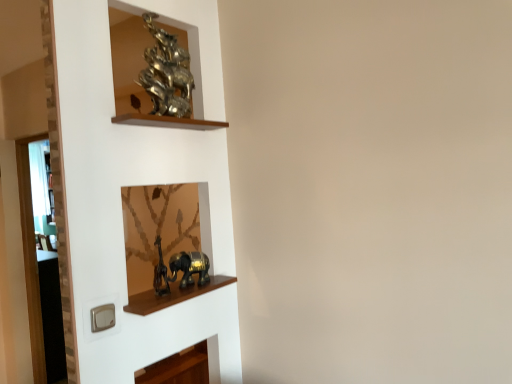
Identify the location of metallic gold elephant at center, placed as the second cabinet when sorted from top to bottom. This screenshot has width=512, height=384. (173, 296).

In order to click on wooden shelf at upper center, marked as the first cabinet in a top-to-bottom arrangement in this screenshot , I will do `click(167, 121)`.

Where is `metallic gold elephant at center, which is the 1th cabinet from bottom to top`? metallic gold elephant at center, which is the 1th cabinet from bottom to top is located at coordinates click(173, 296).

Based on the photo, relative to metallic gold elephant at center, placed as the second cabinet when sorted from top to bottom, is gold metallic elephant at lower center, acting as the 2th art starting from the top, in front or behind?

gold metallic elephant at lower center, acting as the 2th art starting from the top, is positioned farther from the viewer than metallic gold elephant at center, placed as the second cabinet when sorted from top to bottom.

Can you confirm if gold metallic elephant at lower center, the 1th art when ordered from bottom to top, is bigger than metallic gold elephant at center, which is the 1th cabinet from bottom to top?

Correct, gold metallic elephant at lower center, the 1th art when ordered from bottom to top, is larger in size than metallic gold elephant at center, which is the 1th cabinet from bottom to top.

Which is more distant, (189,281) or (200,286)?

The point (200,286) is farther.

Is gold metallic elephant at lower center, acting as the 2th art starting from the top, placed right next to metallic gold elephant at center, which is the 1th cabinet from bottom to top?

Yes.

The height and width of the screenshot is (384, 512). What are the coordinates of `cabinet to the left of metallic gold elephant at center, placed as the second cabinet when sorted from top to bottom` in the screenshot? It's located at (167, 121).

From the picture: From a real-world perspective, is metallic gold elephant at center, which is the 1th cabinet from bottom to top, over wooden shelf at upper center, the 2th cabinet ordered from the bottom?

No, from a real-world perspective, metallic gold elephant at center, which is the 1th cabinet from bottom to top, is not over wooden shelf at upper center, the 2th cabinet ordered from the bottom

Based on their positions, is metallic gold elephant at center, which is the 1th cabinet from bottom to top, located to the left or right of wooden shelf at upper center, the 2th cabinet ordered from the bottom?

metallic gold elephant at center, which is the 1th cabinet from bottom to top, is to the right of wooden shelf at upper center, the 2th cabinet ordered from the bottom.

Is metallic gold elephant at center, placed as the second cabinet when sorted from top to bottom, positioned with its back to wooden shelf at upper center, the 2th cabinet ordered from the bottom?

metallic gold elephant at center, placed as the second cabinet when sorted from top to bottom, is not turned away from wooden shelf at upper center, the 2th cabinet ordered from the bottom.

From a real-world perspective, is shiny metallic sculpture at upper left, positioned as the 1th art in top-to-bottom order, physically below gold metallic elephant at lower center, acting as the 2th art starting from the top?

No.

Is shiny metallic sculpture at upper left, which is the 2th art in bottom-to-top order, inside or outside of gold metallic elephant at lower center, the 1th art when ordered from bottom to top?

shiny metallic sculpture at upper left, which is the 2th art in bottom-to-top order, is spatially situated outside gold metallic elephant at lower center, the 1th art when ordered from bottom to top.

From the image's perspective, relative to gold metallic elephant at lower center, the 1th art when ordered from bottom to top, is shiny metallic sculpture at upper left, which is the 2th art in bottom-to-top order, above or below?

From the image's perspective, shiny metallic sculpture at upper left, which is the 2th art in bottom-to-top order, appears above gold metallic elephant at lower center, the 1th art when ordered from bottom to top.

Can you tell me how much shiny metallic sculpture at upper left, positioned as the 1th art in top-to-bottom order, and gold metallic elephant at lower center, the 1th art when ordered from bottom to top, differ in facing direction?

8.55e-05 degrees.

From the picture: Is wooden shelf at upper center, the 2th cabinet ordered from the bottom, wider or thinner than gold metallic elephant at lower center, acting as the 2th art starting from the top?

In the image, wooden shelf at upper center, the 2th cabinet ordered from the bottom, appears to be wider than gold metallic elephant at lower center, acting as the 2th art starting from the top.

From a real-world perspective, which is physically above, wooden shelf at upper center, marked as the first cabinet in a top-to-bottom arrangement, or gold metallic elephant at lower center, the 1th art when ordered from bottom to top?

In real-world perspective, wooden shelf at upper center, marked as the first cabinet in a top-to-bottom arrangement, is above.

Is wooden shelf at upper center, marked as the first cabinet in a top-to-bottom arrangement, taller than gold metallic elephant at lower center, the 1th art when ordered from bottom to top?

In fact, wooden shelf at upper center, marked as the first cabinet in a top-to-bottom arrangement, may be shorter than gold metallic elephant at lower center, the 1th art when ordered from bottom to top.

Considering the relative sizes of metallic gold elephant at center, which is the 1th cabinet from bottom to top, and gold metallic elephant at lower center, acting as the 2th art starting from the top, in the image provided, is metallic gold elephant at center, which is the 1th cabinet from bottom to top, taller than gold metallic elephant at lower center, acting as the 2th art starting from the top,?

Incorrect, the height of metallic gold elephant at center, which is the 1th cabinet from bottom to top, is not larger of that of gold metallic elephant at lower center, acting as the 2th art starting from the top.

Looking at the image, does metallic gold elephant at center, placed as the second cabinet when sorted from top to bottom, seem bigger or smaller compared to gold metallic elephant at lower center, the 1th art when ordered from bottom to top?

metallic gold elephant at center, placed as the second cabinet when sorted from top to bottom, is smaller than gold metallic elephant at lower center, the 1th art when ordered from bottom to top.

In the scene shown: From the image's perspective, is metallic gold elephant at center, placed as the second cabinet when sorted from top to bottom, located above gold metallic elephant at lower center, the 1th art when ordered from bottom to top?

No, from the image's perspective, metallic gold elephant at center, placed as the second cabinet when sorted from top to bottom, is not over gold metallic elephant at lower center, the 1th art when ordered from bottom to top.

Which object is positioned more to the right, gold metallic elephant at lower center, the 1th art when ordered from bottom to top, or shiny metallic sculpture at upper left, which is the 2th art in bottom-to-top order?

gold metallic elephant at lower center, the 1th art when ordered from bottom to top, is more to the right.

In the scene shown: Considering the sizes of objects gold metallic elephant at lower center, acting as the 2th art starting from the top, and shiny metallic sculpture at upper left, positioned as the 1th art in top-to-bottom order, in the image provided, who is wider, gold metallic elephant at lower center, acting as the 2th art starting from the top, or shiny metallic sculpture at upper left, positioned as the 1th art in top-to-bottom order,?

shiny metallic sculpture at upper left, positioned as the 1th art in top-to-bottom order, is wider.

The width and height of the screenshot is (512, 384). Find the location of `art in front of the gold metallic elephant at lower center, the 1th art when ordered from bottom to top`. art in front of the gold metallic elephant at lower center, the 1th art when ordered from bottom to top is located at coordinates (166, 73).

Considering the relative sizes of gold metallic elephant at lower center, the 1th art when ordered from bottom to top, and shiny metallic sculpture at upper left, which is the 2th art in bottom-to-top order, in the image provided, is gold metallic elephant at lower center, the 1th art when ordered from bottom to top, taller than shiny metallic sculpture at upper left, which is the 2th art in bottom-to-top order,?

No.

Consider the image. Which of these two, wooden shelf at upper center, the 2th cabinet ordered from the bottom, or shiny metallic sculpture at upper left, which is the 2th art in bottom-to-top order, is thinner?

wooden shelf at upper center, the 2th cabinet ordered from the bottom.

Does point (139, 115) appear closer or farther from the camera than point (170, 75)?

Point (139, 115).

Are wooden shelf at upper center, marked as the first cabinet in a top-to-bottom arrangement, and shiny metallic sculpture at upper left, positioned as the 1th art in top-to-bottom order, far apart?

Actually, wooden shelf at upper center, marked as the first cabinet in a top-to-bottom arrangement, and shiny metallic sculpture at upper left, positioned as the 1th art in top-to-bottom order, are a little close together.

Who is bigger, wooden shelf at upper center, the 2th cabinet ordered from the bottom, or shiny metallic sculpture at upper left, positioned as the 1th art in top-to-bottom order?

shiny metallic sculpture at upper left, positioned as the 1th art in top-to-bottom order.

Where is `cabinet that appears below the gold metallic elephant at lower center, the 1th art when ordered from bottom to top (from a real-world perspective)`? The height and width of the screenshot is (384, 512). cabinet that appears below the gold metallic elephant at lower center, the 1th art when ordered from bottom to top (from a real-world perspective) is located at coordinates (173, 296).

Identify the location of cabinet behind the wooden shelf at upper center, the 2th cabinet ordered from the bottom. The image size is (512, 384). (173, 296).

From the image, which object appears to be nearer to gold metallic elephant at lower center, acting as the 2th art starting from the top, wooden shelf at upper center, marked as the first cabinet in a top-to-bottom arrangement, or metallic gold elephant at center, which is the 1th cabinet from bottom to top?

metallic gold elephant at center, which is the 1th cabinet from bottom to top.

Consider the image. Based on their spatial positions, is gold metallic elephant at lower center, the 1th art when ordered from bottom to top, or shiny metallic sculpture at upper left, which is the 2th art in bottom-to-top order, closer to metallic gold elephant at center, which is the 1th cabinet from bottom to top?

Among the two, gold metallic elephant at lower center, the 1th art when ordered from bottom to top, is located nearer to metallic gold elephant at center, which is the 1th cabinet from bottom to top.

When comparing their distances from wooden shelf at upper center, marked as the first cabinet in a top-to-bottom arrangement, does shiny metallic sculpture at upper left, which is the 2th art in bottom-to-top order, or gold metallic elephant at lower center, the 1th art when ordered from bottom to top, seem closer?

shiny metallic sculpture at upper left, which is the 2th art in bottom-to-top order, lies closer to wooden shelf at upper center, marked as the first cabinet in a top-to-bottom arrangement, than the other object.

Estimate the real-world distances between objects in this image. Which object is closer to metallic gold elephant at center, placed as the second cabinet when sorted from top to bottom, gold metallic elephant at lower center, the 1th art when ordered from bottom to top, or wooden shelf at upper center, marked as the first cabinet in a top-to-bottom arrangement?

gold metallic elephant at lower center, the 1th art when ordered from bottom to top, lies closer to metallic gold elephant at center, placed as the second cabinet when sorted from top to bottom, than the other object.

Based on their spatial positions, is gold metallic elephant at lower center, the 1th art when ordered from bottom to top, or metallic gold elephant at center, placed as the second cabinet when sorted from top to bottom, closer to shiny metallic sculpture at upper left, which is the 2th art in bottom-to-top order?

Among the two, gold metallic elephant at lower center, the 1th art when ordered from bottom to top, is located nearer to shiny metallic sculpture at upper left, which is the 2th art in bottom-to-top order.

Which object lies nearer to the anchor point metallic gold elephant at center, which is the 1th cabinet from bottom to top, shiny metallic sculpture at upper left, positioned as the 1th art in top-to-bottom order, or gold metallic elephant at lower center, acting as the 2th art starting from the top?

gold metallic elephant at lower center, acting as the 2th art starting from the top, is closer to metallic gold elephant at center, which is the 1th cabinet from bottom to top.

Consider the image. Considering their positions, is gold metallic elephant at lower center, the 1th art when ordered from bottom to top, positioned closer to wooden shelf at upper center, marked as the first cabinet in a top-to-bottom arrangement, than shiny metallic sculpture at upper left, positioned as the 1th art in top-to-bottom order?

The object closer to wooden shelf at upper center, marked as the first cabinet in a top-to-bottom arrangement, is shiny metallic sculpture at upper left, positioned as the 1th art in top-to-bottom order.

Estimate the real-world distances between objects in this image. Which object is closer to wooden shelf at upper center, marked as the first cabinet in a top-to-bottom arrangement, metallic gold elephant at center, placed as the second cabinet when sorted from top to bottom, or shiny metallic sculpture at upper left, positioned as the 1th art in top-to-bottom order?

Among the two, shiny metallic sculpture at upper left, positioned as the 1th art in top-to-bottom order, is located nearer to wooden shelf at upper center, marked as the first cabinet in a top-to-bottom arrangement.

Locate an element on the screen. This screenshot has width=512, height=384. art between shiny metallic sculpture at upper left, positioned as the 1th art in top-to-bottom order, and metallic gold elephant at center, placed as the second cabinet when sorted from top to bottom, vertically is located at coordinates (189, 267).

Where is `art between wooden shelf at upper center, the 2th cabinet ordered from the bottom, and metallic gold elephant at center, placed as the second cabinet when sorted from top to bottom, in the up-down direction`? The image size is (512, 384). art between wooden shelf at upper center, the 2th cabinet ordered from the bottom, and metallic gold elephant at center, placed as the second cabinet when sorted from top to bottom, in the up-down direction is located at coordinates (189, 267).

Find the location of a particular element. cabinet between shiny metallic sculpture at upper left, which is the 2th art in bottom-to-top order, and gold metallic elephant at lower center, acting as the 2th art starting from the top, vertically is located at coordinates pos(167,121).

Where is `cabinet between shiny metallic sculpture at upper left, positioned as the 1th art in top-to-bottom order, and metallic gold elephant at center, placed as the second cabinet when sorted from top to bottom, in the up-down direction`? Image resolution: width=512 pixels, height=384 pixels. cabinet between shiny metallic sculpture at upper left, positioned as the 1th art in top-to-bottom order, and metallic gold elephant at center, placed as the second cabinet when sorted from top to bottom, in the up-down direction is located at coordinates (167, 121).